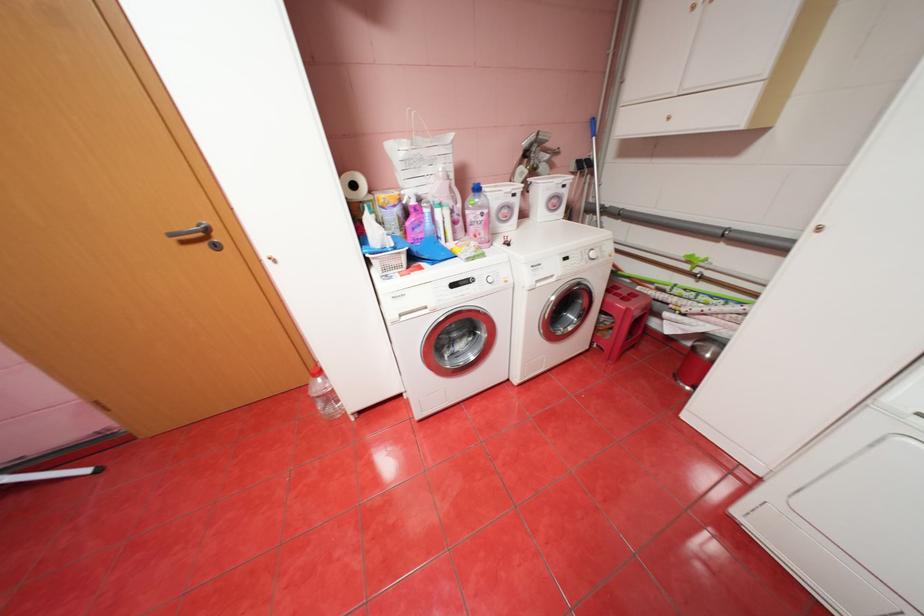
Describe the element at coordinates (593, 140) in the screenshot. The height and width of the screenshot is (616, 924). I see `a blue mop handle` at that location.